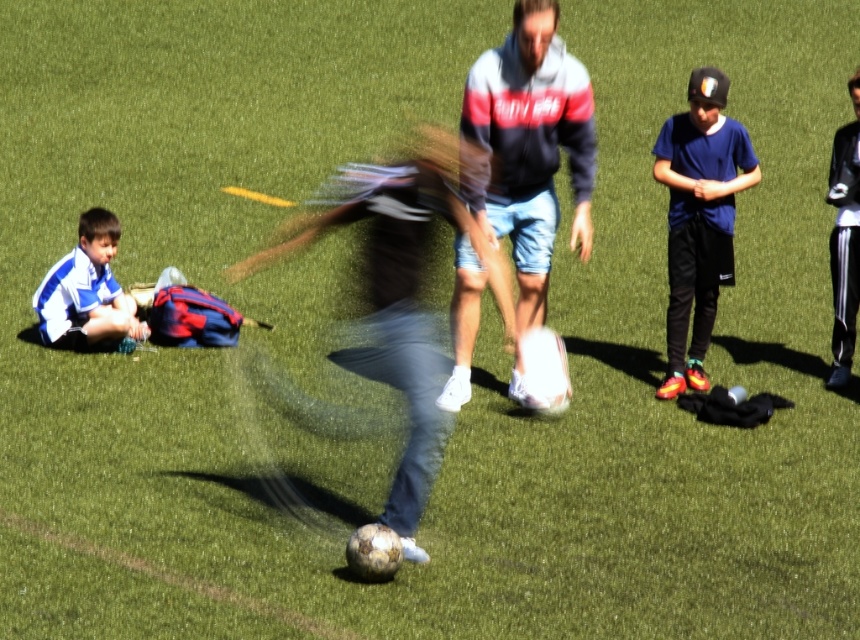
Is blue jersey at right to the right of black leather jacket at right from the viewer's perspective?

In fact, blue jersey at right is to the left of black leather jacket at right.

The image size is (860, 640). In order to click on blue jersey at right in this screenshot , I will do `click(699, 218)`.

What are the coordinates of `blue jersey at right` in the screenshot? It's located at (699, 218).

Does blue jersey at right appear on the left side of striped jersey at lower left?

In fact, blue jersey at right is to the right of striped jersey at lower left.

Which of these two, blue jersey at right or striped jersey at lower left, stands shorter?

striped jersey at lower left

Measure the distance between blue jersey at right and camera.

blue jersey at right is 32.21 feet away from camera.

Locate an element on the screen. blue jersey at right is located at coordinates (699, 218).

Looking at this image, is dark gray hoodie at center thinner than blue jersey at right?

No.

Is dark gray hoodie at center bigger than blue jersey at right?

Correct, dark gray hoodie at center is larger in size than blue jersey at right.

The height and width of the screenshot is (640, 860). What do you see at coordinates (530, 147) in the screenshot?
I see `dark gray hoodie at center` at bounding box center [530, 147].

At what (x,y) coordinates should I click in order to perform the action: click on dark gray hoodie at center. Please return your answer as a coordinate pair (x, y). This screenshot has width=860, height=640. Looking at the image, I should click on (530, 147).